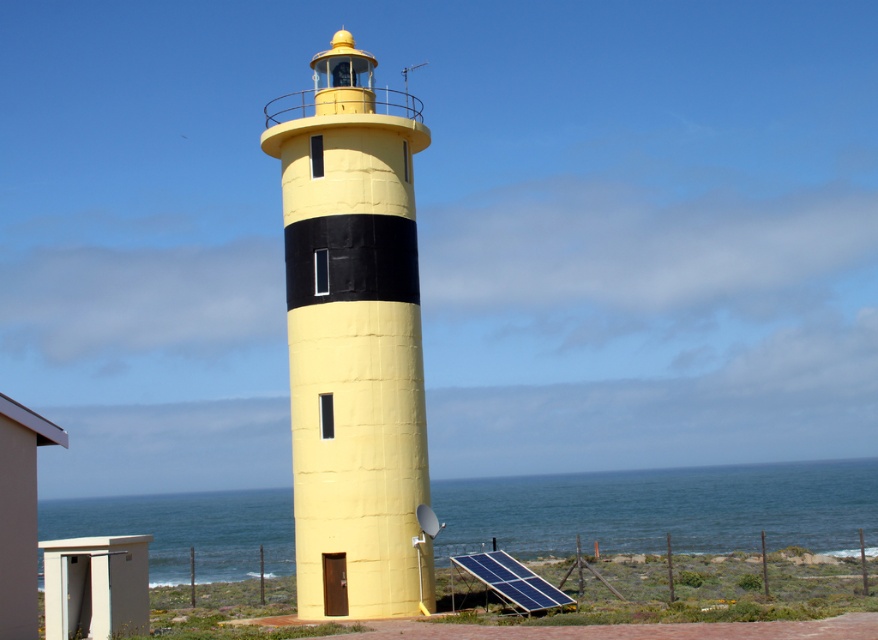
Who is lower down, blue water at lower center or blue photovoltaic panel at lower right?

blue water at lower center is below.

What do you see at coordinates (661, 509) in the screenshot? I see `blue water at lower center` at bounding box center [661, 509].

Measure the distance between blue water at lower center and camera.

26.11 meters

Image resolution: width=878 pixels, height=640 pixels. Identify the location of blue water at lower center. (661, 509).

Can you confirm if yellow matte/lightweight tower at center is smaller than blue photovoltaic panel at lower right?

No, yellow matte/lightweight tower at center is not smaller than blue photovoltaic panel at lower right.

Who is positioned more to the left, yellow matte/lightweight tower at center or blue photovoltaic panel at lower right?

Positioned to the left is yellow matte/lightweight tower at center.

Where is `yellow matte/lightweight tower at center`? yellow matte/lightweight tower at center is located at coordinates (353, 339).

I want to click on yellow matte/lightweight tower at center, so click(353, 339).

Measure the distance between yellow matte/lightweight tower at center and camera.

32.44 meters

Identify the location of yellow matte/lightweight tower at center. This screenshot has height=640, width=878. (353, 339).